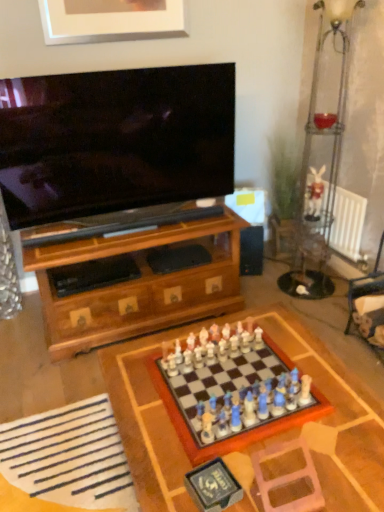
Describe the element at coordinates (315, 194) in the screenshot. Image resolution: width=384 pixels, height=512 pixels. I see `white fabric rabbit at right` at that location.

In order to face white metallic radiator at right, should I rotate leftwards or rightwards?

Turn right approximately 18.393 degrees to face it.

The height and width of the screenshot is (512, 384). What do you see at coordinates (348, 225) in the screenshot?
I see `white metallic radiator at right` at bounding box center [348, 225].

Locate an element on the screen. The width and height of the screenshot is (384, 512). white fabric swivel chair at lower right, which appears as the second swivel chair when viewed from the left is located at coordinates (365, 285).

In order to face wooden chess set at center, should I rotate leftwards or rightwards?

To face it directly, rotate right by 5.083 degrees.

What is the approximate width of wooden chess set at center?

wooden chess set at center is 18.48 inches in width.

The height and width of the screenshot is (512, 384). Describe the element at coordinates (110, 20) in the screenshot. I see `brushed silver picture frame at upper center` at that location.

The height and width of the screenshot is (512, 384). I want to click on pink plastic swivel chair at lower right, which ranks as the 2th swivel chair in top-to-bottom order, so click(x=288, y=478).

Between pink plastic swivel chair at lower right, which ranks as the first swivel chair in bottom-to-top order, and white fabric rabbit at right, which one has smaller width?

Thinner between the two is white fabric rabbit at right.

Is pink plastic swivel chair at lower right, which ranks as the first swivel chair in bottom-to-top order, next to white fabric rabbit at right?

pink plastic swivel chair at lower right, which ranks as the first swivel chair in bottom-to-top order, and white fabric rabbit at right are clearly separated.

From the picture: Do you think pink plastic swivel chair at lower right, which ranks as the 2th swivel chair in top-to-bottom order, is within white fabric rabbit at right, or outside of it?

pink plastic swivel chair at lower right, which ranks as the 2th swivel chair in top-to-bottom order, lies outside white fabric rabbit at right.

Which object is positioned more to the left, pink plastic swivel chair at lower right, which ranks as the first swivel chair in bottom-to-top order, or white fabric rabbit at right?

From the viewer's perspective, pink plastic swivel chair at lower right, which ranks as the first swivel chair in bottom-to-top order, appears more on the left side.

In the scene shown: Could you tell me if pink plastic swivel chair at lower right, the first swivel chair positioned from the left, is turned towards brushed silver picture frame at upper center?

No, pink plastic swivel chair at lower right, the first swivel chair positioned from the left, is not turned towards brushed silver picture frame at upper center.

Does point (313, 465) come closer to viewer compared to point (163, 28)?

Yes, it is.

Is pink plastic swivel chair at lower right, which ranks as the 2th swivel chair in top-to-bottom order, at the right side of brushed silver picture frame at upper center?

Indeed, pink plastic swivel chair at lower right, which ranks as the 2th swivel chair in top-to-bottom order, is positioned on the right side of brushed silver picture frame at upper center.

From the image's perspective, does white fabric at lower left appear lower than pink plastic swivel chair at lower right, positioned as the first swivel chair in front-to-back order?

Yes, from the image's perspective, white fabric at lower left is below pink plastic swivel chair at lower right, positioned as the first swivel chair in front-to-back order.

Is white fabric at lower left facing away from pink plastic swivel chair at lower right, the first swivel chair positioned from the left?

No.

Would you say pink plastic swivel chair at lower right, which ranks as the first swivel chair in bottom-to-top order, is part of white fabric at lower left's contents?

No, pink plastic swivel chair at lower right, which ranks as the first swivel chair in bottom-to-top order, is not a part of white fabric at lower left.

How many degrees apart are the facing directions of white fabric at lower left and pink plastic swivel chair at lower right, positioned as the first swivel chair in front-to-back order?

The angle between the facing direction of white fabric at lower left and the facing direction of pink plastic swivel chair at lower right, positioned as the first swivel chair in front-to-back order, is 175 degrees.

From a real-world perspective, is white fabric swivel chair at lower right, which appears as the second swivel chair when viewed from the left, physically located above or below wooden chess set at center?

In terms of real-world spatial position, white fabric swivel chair at lower right, which appears as the second swivel chair when viewed from the left, is below wooden chess set at center.

Between white fabric swivel chair at lower right, which appears as the second swivel chair when viewed from the left, and wooden chess set at center, which one has smaller size?

wooden chess set at center is smaller.

From the image's perspective, which is above, white fabric swivel chair at lower right, the 1th swivel chair in the back-to-front sequence, or wooden chess set at center?

white fabric swivel chair at lower right, the 1th swivel chair in the back-to-front sequence, appears higher in the image.

Is white fabric swivel chair at lower right, which is counted as the 1th swivel chair, starting from the right, far from wooden chess set at center?

Yes, white fabric swivel chair at lower right, which is counted as the 1th swivel chair, starting from the right, and wooden chess set at center are quite far apart.

Which of these two, white fabric swivel chair at lower right, the 2th swivel chair from the front, or pink plastic swivel chair at lower right, which ranks as the 2th swivel chair in top-to-bottom order, is thinner?

Thinner between the two is pink plastic swivel chair at lower right, which ranks as the 2th swivel chair in top-to-bottom order.

Can you confirm if white fabric swivel chair at lower right, which is the 2th swivel chair from bottom to top, is taller than pink plastic swivel chair at lower right, which appears as the second swivel chair when viewed from the back?

Indeed, white fabric swivel chair at lower right, which is the 2th swivel chair from bottom to top, has a greater height compared to pink plastic swivel chair at lower right, which appears as the second swivel chair when viewed from the back.

Considering the positions of objects white fabric swivel chair at lower right, which appears as the second swivel chair when viewed from the left, and pink plastic swivel chair at lower right, which ranks as the 2th swivel chair in top-to-bottom order, in the image provided, who is in front, white fabric swivel chair at lower right, which appears as the second swivel chair when viewed from the left, or pink plastic swivel chair at lower right, which ranks as the 2th swivel chair in top-to-bottom order,?

pink plastic swivel chair at lower right, which ranks as the 2th swivel chair in top-to-bottom order, is closer to the camera.

Who is smaller, white fabric swivel chair at lower right, which is the 2th swivel chair from bottom to top, or pink plastic swivel chair at lower right, positioned as the first swivel chair in front-to-back order?

pink plastic swivel chair at lower right, positioned as the first swivel chair in front-to-back order, is smaller.

In the scene shown: Considering the sizes of objects white fabric at lower left and white fabric swivel chair at lower right, the 1th swivel chair in the back-to-front sequence, in the image provided, who is wider, white fabric at lower left or white fabric swivel chair at lower right, the 1th swivel chair in the back-to-front sequence,?

white fabric at lower left.

Can you confirm if white fabric at lower left is shorter than white fabric swivel chair at lower right, which is counted as the 1th swivel chair, starting from the right?

Correct, white fabric at lower left is not as tall as white fabric swivel chair at lower right, which is counted as the 1th swivel chair, starting from the right.

Does brushed silver picture frame at upper center turn towards pink plastic swivel chair at lower right, the 2th swivel chair when ordered from right to left?

No, brushed silver picture frame at upper center is not oriented towards pink plastic swivel chair at lower right, the 2th swivel chair when ordered from right to left.

Can you confirm if brushed silver picture frame at upper center is smaller than pink plastic swivel chair at lower right, the 2th swivel chair when ordered from right to left?

Actually, brushed silver picture frame at upper center might be larger than pink plastic swivel chair at lower right, the 2th swivel chair when ordered from right to left.

How much distance is there between brushed silver picture frame at upper center and pink plastic swivel chair at lower right, which ranks as the first swivel chair in bottom-to-top order?

brushed silver picture frame at upper center and pink plastic swivel chair at lower right, which ranks as the first swivel chair in bottom-to-top order, are 7.55 feet apart from each other.

Which is behind, point (82, 29) or point (316, 505)?

The point (82, 29) is farther.

The width and height of the screenshot is (384, 512). There is a white fabric rabbit at right. In order to click on the 1st swivel chair below it (from a real-world perspective) in this screenshot , I will do `click(288, 478)`.

Identify the location of picture frame to the left of pink plastic swivel chair at lower right, positioned as the first swivel chair in front-to-back order. (110, 20).

From the image, which object appears to be farther from white fabric at lower left, white metallic radiator at right or pink plastic swivel chair at lower right, the 2th swivel chair when ordered from right to left?

white metallic radiator at right lies further to white fabric at lower left than the other object.

Estimate the real-world distances between objects in this image. Which object is further from wooden chessboard at center, white metallic radiator at right or brushed silver picture frame at upper center?

The object further to wooden chessboard at center is brushed silver picture frame at upper center.

Estimate the real-world distances between objects in this image. Which object is further from white fabric swivel chair at lower right, the 2th swivel chair from the front, white fabric rabbit at right or brushed silver picture frame at upper center?

brushed silver picture frame at upper center is positioned further to the anchor white fabric swivel chair at lower right, the 2th swivel chair from the front.

Considering their positions, is wooden chess set at center positioned closer to white metallic radiator at right than white fabric swivel chair at lower right, which is the 2th swivel chair from bottom to top?

white fabric swivel chair at lower right, which is the 2th swivel chair from bottom to top, is closer to white metallic radiator at right.

Based on their spatial positions, is brushed silver picture frame at upper center or wooden chess set at center closer to wooden chessboard at center?

The object closer to wooden chessboard at center is wooden chess set at center.

Estimate the real-world distances between objects in this image. Which object is further from pink plastic swivel chair at lower right, the first swivel chair positioned from the left, wooden chess set at center or white fabric at lower left?

white fabric at lower left is further to pink plastic swivel chair at lower right, the first swivel chair positioned from the left.

Which object lies further to the anchor point white metallic radiator at right, pink plastic swivel chair at lower right, the first swivel chair positioned from the left, or white fabric rabbit at right?

Based on the image, pink plastic swivel chair at lower right, the first swivel chair positioned from the left, appears to be further to white metallic radiator at right.

Considering their positions, is white fabric swivel chair at lower right, which is the 2th swivel chair from bottom to top, positioned further to brushed silver picture frame at upper center than white fabric rabbit at right?

white fabric swivel chair at lower right, which is the 2th swivel chair from bottom to top.

At what (x,y) coordinates should I click in order to perform the action: click on flat between pink plastic swivel chair at lower right, which ranks as the first swivel chair in bottom-to-top order, and white metallic radiator at right in the front-back direction. Please return your answer as a coordinate pair (x, y). Looking at the image, I should click on (69, 456).

The height and width of the screenshot is (512, 384). Find the location of `radiator between brushed silver picture frame at upper center and pink plastic swivel chair at lower right, the first swivel chair positioned from the left, in the vertical direction`. radiator between brushed silver picture frame at upper center and pink plastic swivel chair at lower right, the first swivel chair positioned from the left, in the vertical direction is located at coordinates [x=348, y=225].

Where is `swivel chair located between wooden chess set at center and white fabric swivel chair at lower right, the 1th swivel chair from the top, in the left-right direction`? This screenshot has width=384, height=512. swivel chair located between wooden chess set at center and white fabric swivel chair at lower right, the 1th swivel chair from the top, in the left-right direction is located at coordinates (288, 478).

Where is `radiator between brushed silver picture frame at upper center and wooden chessboard at center in the up-down direction`? radiator between brushed silver picture frame at upper center and wooden chessboard at center in the up-down direction is located at coordinates (348, 225).